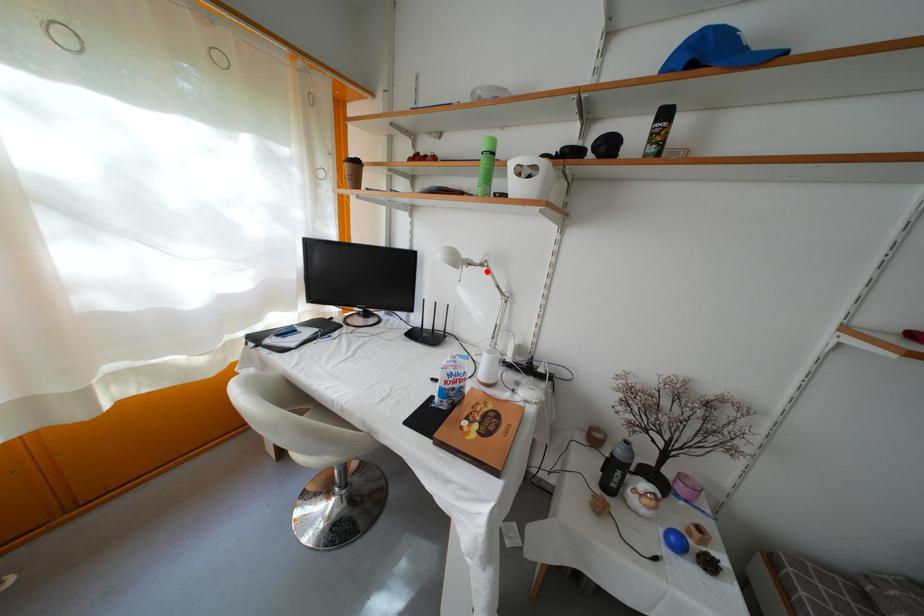
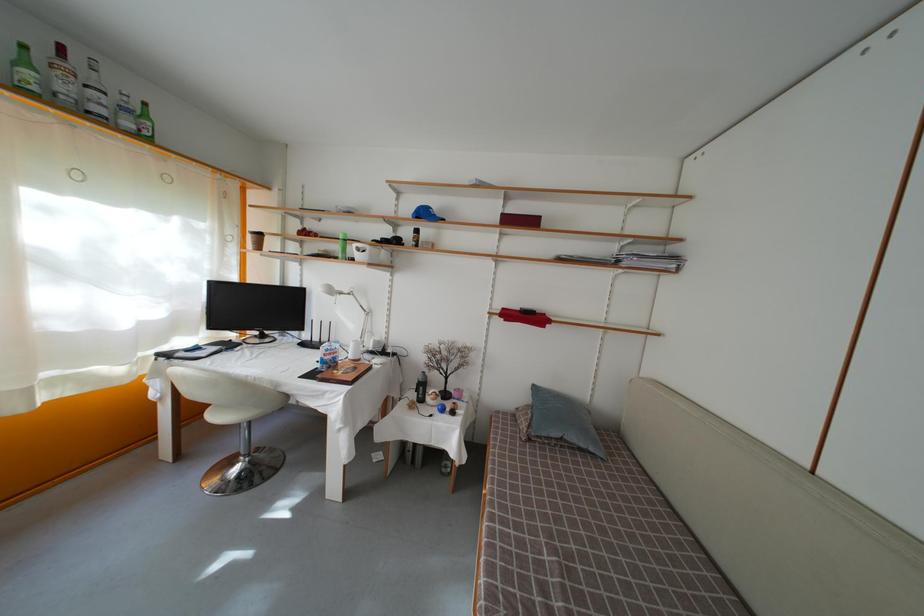
Where in the second image is the point corresponding to the highlighted location from the first image?

(355, 301)